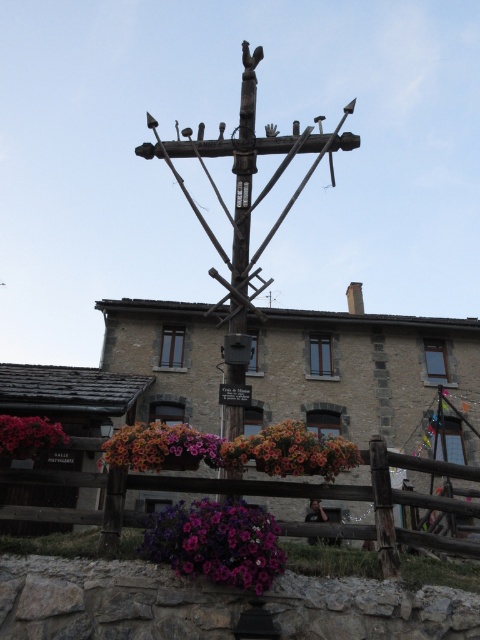
Question: Is the position of wooden cross at center more distant than that of purple matte flower at center?

Choices:
 (A) no
 (B) yes

Answer: (B)

Question: Estimate the real-world distances between objects in this image. Which object is farther from the purple matte flower at center?

Choices:
 (A) multicolored fabric flower at center
 (B) wooden at lower center

Answer: (A)

Question: Which object is positioned closest to the multicolored fabric flower at center?

Choices:
 (A) wooden at lower center
 (B) vibrant floral basket at center

Answer: (A)

Question: Is purple matte flower at center to the left of multicolored fabric flower at center from the viewer's perspective?

Choices:
 (A) no
 (B) yes

Answer: (A)

Question: Among these objects, which one is nearest to the camera?

Choices:
 (A) wooden at lower center
 (B) purple matte flower at lower left
 (C) purple matte flower at center
 (D) wooden cross at center

Answer: (C)

Question: Is purple matte flower at center smaller than vibrant floral basket at center?

Choices:
 (A) no
 (B) yes

Answer: (B)